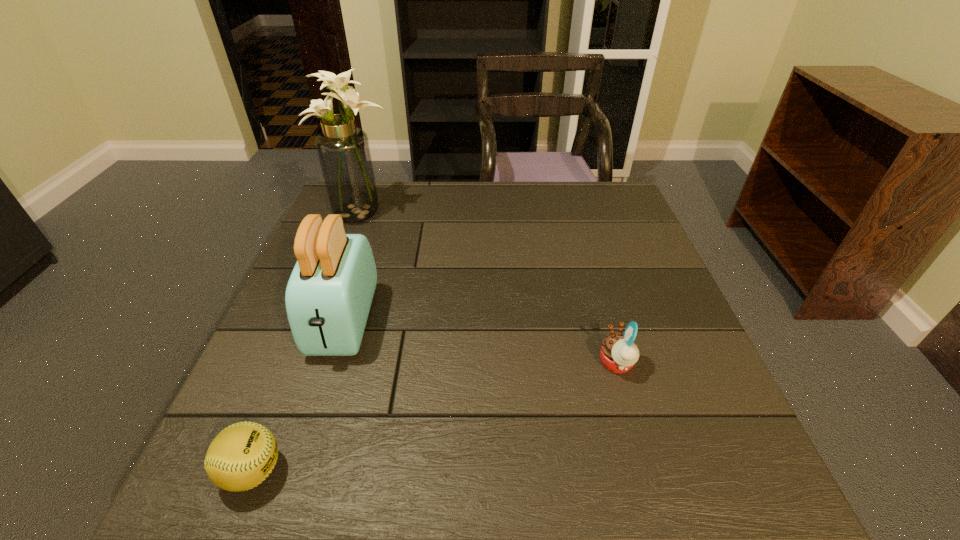
The height and width of the screenshot is (540, 960). I want to click on free point located on the logo side of the nearest object, so click(x=458, y=471).

This screenshot has height=540, width=960. In order to click on object that is at the far edge in this screenshot , I will do pos(343,150).

The width and height of the screenshot is (960, 540). What are the coordinates of `object present at the near edge` in the screenshot? It's located at (241, 456).

This screenshot has width=960, height=540. I want to click on flower arrangement present at the left edge, so click(343, 150).

This screenshot has width=960, height=540. What are the coordinates of `toaster located in the left edge section of the desktop` in the screenshot? It's located at (328, 297).

Where is `softball that is positioned at the left edge`? Image resolution: width=960 pixels, height=540 pixels. softball that is positioned at the left edge is located at coordinates [x=241, y=456].

The width and height of the screenshot is (960, 540). I want to click on object located in the right edge section of the desktop, so click(x=618, y=353).

Image resolution: width=960 pixels, height=540 pixels. I want to click on object at the far left corner, so click(x=343, y=150).

Where is `object present at the near left corner`? The image size is (960, 540). object present at the near left corner is located at coordinates (241, 456).

This screenshot has width=960, height=540. I want to click on free space at the far edge of the desktop, so click(x=500, y=191).